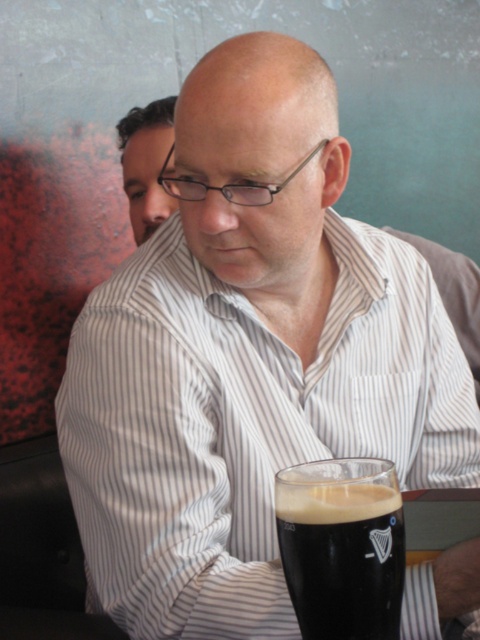
You are standing in front of the bar and want to place a new menu exactly at the point marked as point [276,522]. The menu is 12 inches wide. Can you fit it without overlapping any existing items?

The distance between point [276,522] and the viewer is 23.22 inches. Since the menu is 12 inches wide, there is enough space to place it without overlapping existing items as long as the placement is done carefully within the available area.

You are a bartender trying to clean the dark brown glass at lower center and the matte black hair at upper left. Which object requires a smaller cleaning area?

The dark brown glass at lower center requires a smaller cleaning area because it is smaller than the matte black hair at upper left.

In the scene shown: You are a customer at a bar and see the dark brown glass at lower center and the matte black hair at upper left. Which object is closer to the front of the image?

The dark brown glass at lower center is closer to the front of the image because it is located below the matte black hair at upper left, indicating it is positioned in front of it.